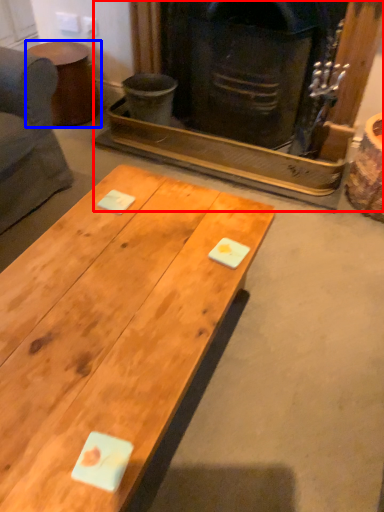
Question: Among these objects, which one is farthest to the camera, fireplace (highlighted by a red box) or side table (highlighted by a blue box)?

Choices:
 (A) fireplace
 (B) side table

Answer: (B)